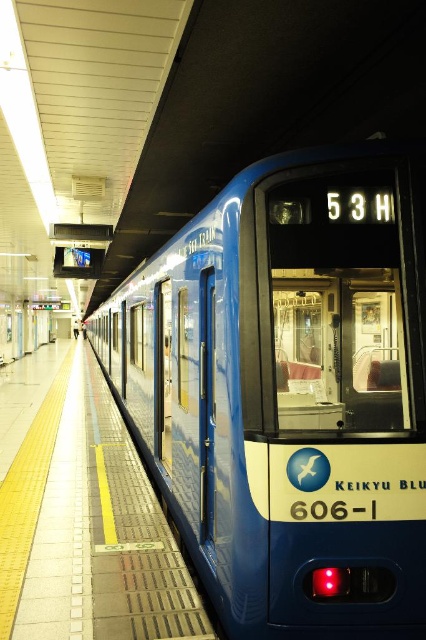
Does blue glossy train at center have a larger size compared to yellow rubber platform at center?

Yes, blue glossy train at center is bigger than yellow rubber platform at center.

From the picture: Can you confirm if blue glossy train at center is taller than yellow rubber platform at center?

Yes, blue glossy train at center is taller than yellow rubber platform at center.

Find the location of a particular element. This screenshot has height=640, width=426. blue glossy train at center is located at coordinates (290, 390).